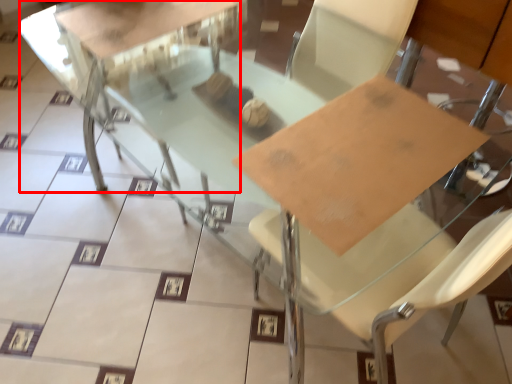
Question: From the image, what is the correct spatial relationship of round table (annotated by the red box) in relation to cardboard?

Choices:
 (A) right
 (B) left

Answer: (B)